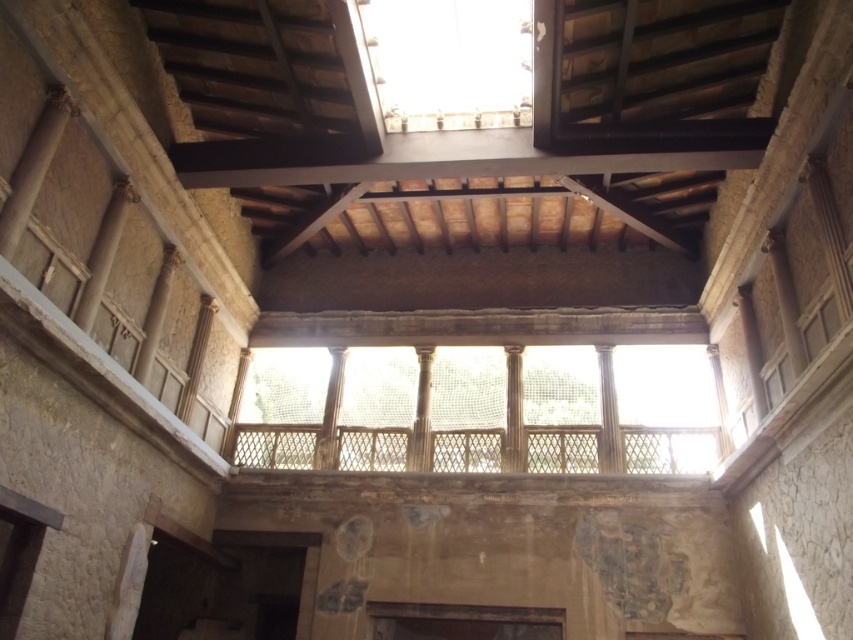
Which of these two, translucent wooden lattice at center or transparent glass window at upper center, stands taller?

translucent wooden lattice at center is taller.

Does translucent wooden lattice at center have a lesser width compared to transparent glass window at upper center?

No, translucent wooden lattice at center is not thinner than transparent glass window at upper center.

Does point (285, 436) lie behind point (479, 68)?

Yes.

Where is `translucent wooden lattice at center`? translucent wooden lattice at center is located at coordinates (479, 410).